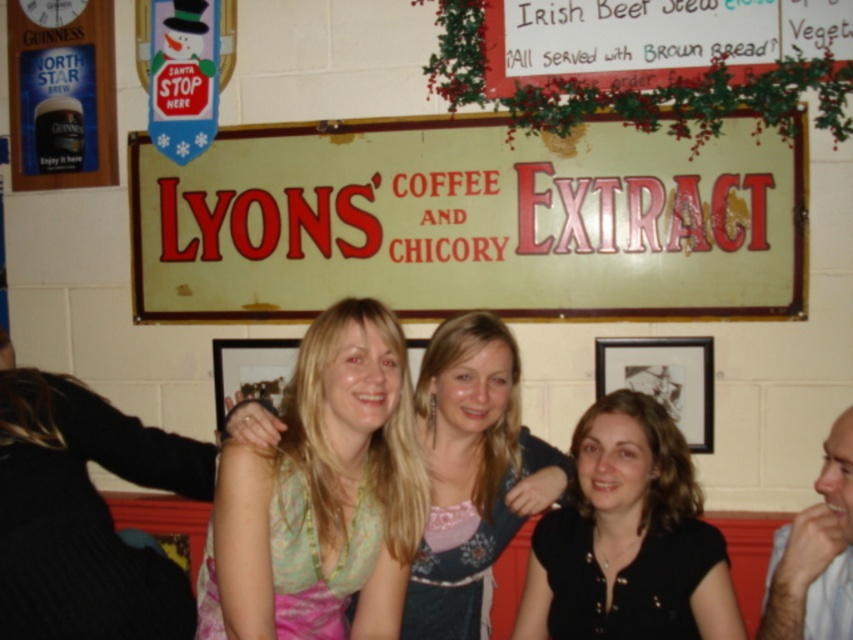
Question: Can you confirm if pastel floral dress at center is smaller than matte blue dress at center?

Choices:
 (A) no
 (B) yes

Answer: (B)

Question: Can you confirm if pastel floral dress at center is positioned below blonde hair at center?

Choices:
 (A) yes
 (B) no

Answer: (A)

Question: Among these points, which one is nearest to the camera?

Choices:
 (A) (181, 620)
 (B) (338, 460)
 (C) (672, 189)
 (D) (438, 392)

Answer: (A)

Question: Which object is positioned closest to the matte blue dress at center?

Choices:
 (A) blonde hair at center
 (B) white paper sign at upper center

Answer: (A)

Question: Which point is closer to the camera?

Choices:
 (A) matte blue dress at center
 (B) black matte shirt at center
 (C) pastel floral dress at center
 (D) white paper sign at upper center

Answer: (C)

Question: Is blonde hair at center positioned behind black matte shirt at center?

Choices:
 (A) no
 (B) yes

Answer: (A)